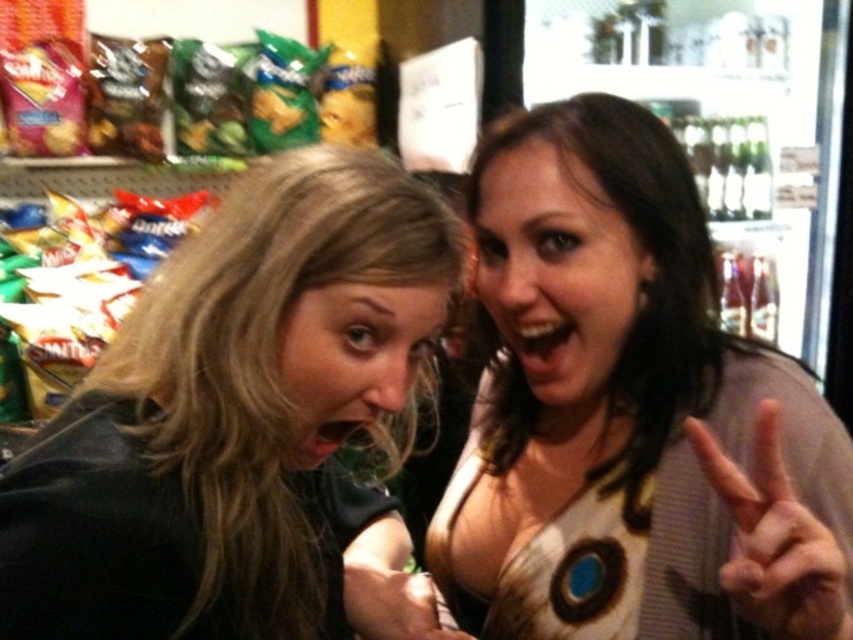
Question: Is white matte chips at left below smooth skin hand at center?

Choices:
 (A) no
 (B) yes

Answer: (A)

Question: Which is farther from the matte brown hair at center?

Choices:
 (A) dark brown hair at left
 (B) matte brown blouse at center
 (C) smooth skin hand at center

Answer: (C)

Question: Which point is closer to the camera taking this photo?

Choices:
 (A) (389, 620)
 (B) (740, 592)
 (C) (635, 136)
 (D) (41, 316)

Answer: (B)

Question: Is matte brown hair at center closer to the viewer compared to white matte chips at left?

Choices:
 (A) yes
 (B) no

Answer: (A)

Question: Is matte brown blouse at center thinner than dark brown hair at left?

Choices:
 (A) yes
 (B) no

Answer: (B)

Question: Which point appears farthest from the camera in this image?

Choices:
 (A) (640, 380)
 (B) (393, 604)
 (C) (811, 547)

Answer: (A)